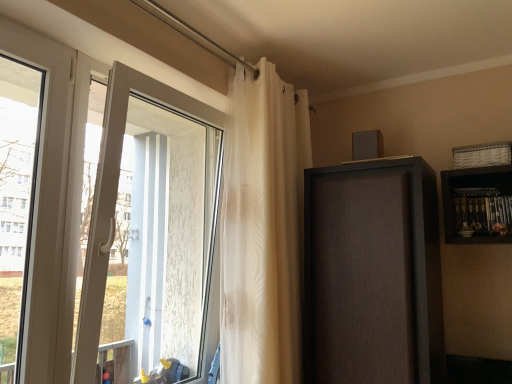
Question: Does matte brown cabinet at upper right turn towards white glossy door at left?

Choices:
 (A) no
 (B) yes

Answer: (A)

Question: Does matte brown cabinet at upper right have a lesser width compared to white glossy door at left?

Choices:
 (A) no
 (B) yes

Answer: (A)

Question: From a real-world perspective, is matte brown cabinet at upper right on top of white glossy door at left?

Choices:
 (A) yes
 (B) no

Answer: (B)

Question: From a real-world perspective, is matte brown cabinet at upper right below white glossy door at left?

Choices:
 (A) yes
 (B) no

Answer: (A)

Question: Is the position of matte brown cabinet at upper right less distant than that of white glossy door at left?

Choices:
 (A) yes
 (B) no

Answer: (B)

Question: From a real-world perspective, is translucent white curtain at upper center positioned above or below white glossy door at left?

Choices:
 (A) above
 (B) below

Answer: (A)

Question: Considering the positions of translucent white curtain at upper center and white glossy door at left in the image, is translucent white curtain at upper center bigger or smaller than white glossy door at left?

Choices:
 (A) small
 (B) big

Answer: (B)

Question: In terms of height, does translucent white curtain at upper center look taller or shorter compared to white glossy door at left?

Choices:
 (A) short
 (B) tall

Answer: (B)

Question: Based on their positions, is translucent white curtain at upper center located to the left or right of white glossy door at left?

Choices:
 (A) left
 (B) right

Answer: (B)

Question: Is white plastic window at left taller or shorter than translucent white curtain at upper center?

Choices:
 (A) tall
 (B) short

Answer: (B)

Question: Based on their sizes in the image, would you say white plastic window at left is bigger or smaller than translucent white curtain at upper center?

Choices:
 (A) small
 (B) big

Answer: (A)

Question: Is white plastic window at left wider or thinner than translucent white curtain at upper center?

Choices:
 (A) thin
 (B) wide

Answer: (A)

Question: Considering the relative positions of white plastic window at left and translucent white curtain at upper center in the image provided, is white plastic window at left to the left or to the right of translucent white curtain at upper center?

Choices:
 (A) left
 (B) right

Answer: (A)

Question: Considering the positions of white glossy door at left and translucent white curtain at upper center in the image, is white glossy door at left taller or shorter than translucent white curtain at upper center?

Choices:
 (A) tall
 (B) short

Answer: (B)

Question: From a real-world perspective, relative to translucent white curtain at upper center, is white glossy door at left vertically above or below?

Choices:
 (A) below
 (B) above

Answer: (A)